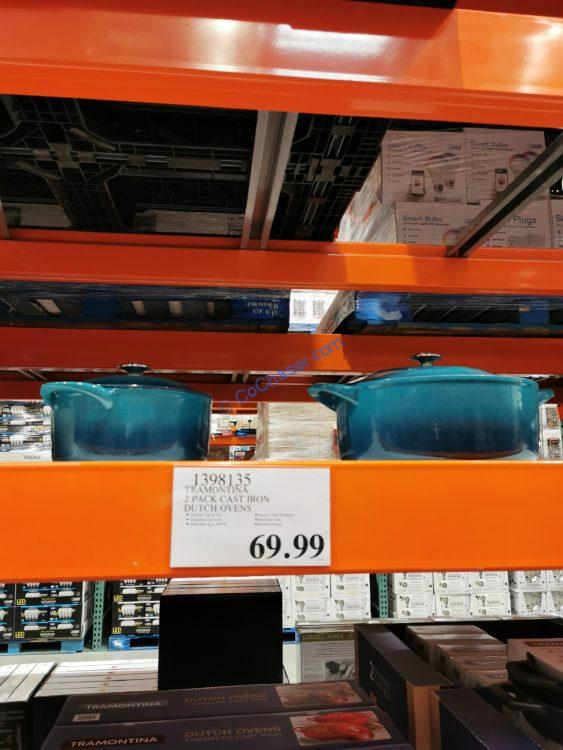
This screenshot has height=750, width=563. Identify the location of dark reddish brown color on shelf edge. (218, 351), (524, 362).